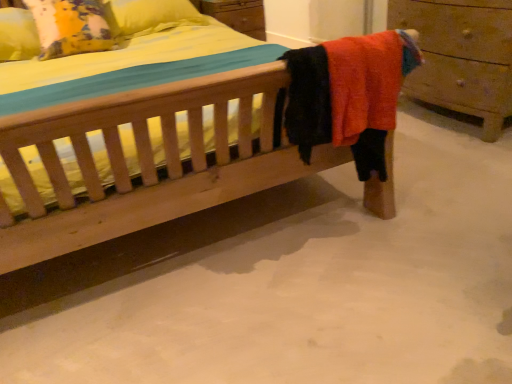
Question: Is yellow fabric pillow at upper left at the right side of white smooth concrete at lower center?

Choices:
 (A) no
 (B) yes

Answer: (A)

Question: Is yellow fabric pillow at upper left further to the viewer compared to white smooth concrete at lower center?

Choices:
 (A) yes
 (B) no

Answer: (A)

Question: Does yellow fabric pillow at upper left turn towards white smooth concrete at lower center?

Choices:
 (A) no
 (B) yes

Answer: (A)

Question: Does yellow fabric pillow at upper left appear on the left side of white smooth concrete at lower center?

Choices:
 (A) no
 (B) yes

Answer: (B)

Question: Does yellow fabric pillow at upper left have a lesser height compared to white smooth concrete at lower center?

Choices:
 (A) yes
 (B) no

Answer: (B)

Question: Is yellow fabric pillow at upper left oriented away from white smooth concrete at lower center?

Choices:
 (A) yes
 (B) no

Answer: (B)

Question: Is white smooth concrete at lower center thinner than wooden chest of drawers at right?

Choices:
 (A) no
 (B) yes

Answer: (A)

Question: Can you confirm if white smooth concrete at lower center is bigger than wooden chest of drawers at right?

Choices:
 (A) no
 (B) yes

Answer: (B)

Question: Is wooden chest of drawers at right at the back of white smooth concrete at lower center?

Choices:
 (A) yes
 (B) no

Answer: (B)

Question: From a real-world perspective, is white smooth concrete at lower center positioned over wooden chest of drawers at right based on gravity?

Choices:
 (A) yes
 (B) no

Answer: (B)

Question: Is white smooth concrete at lower center shorter than wooden chest of drawers at right?

Choices:
 (A) no
 (B) yes

Answer: (B)

Question: Can you confirm if white smooth concrete at lower center is smaller than wooden chest of drawers at right?

Choices:
 (A) no
 (B) yes

Answer: (A)

Question: Is white smooth concrete at lower center closer to the viewer compared to yellow fabric pillow at upper left?

Choices:
 (A) no
 (B) yes

Answer: (B)